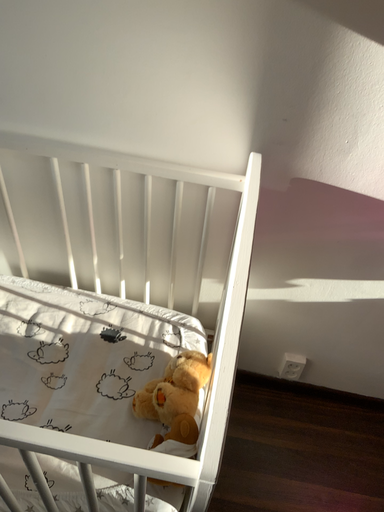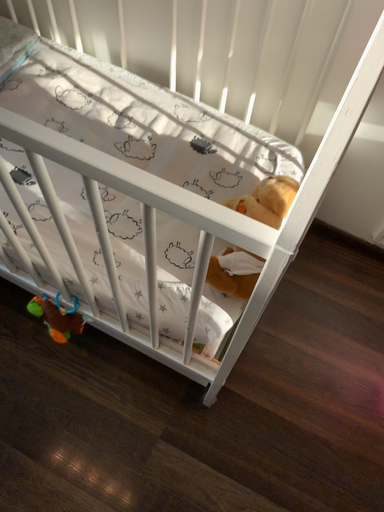
Question: How did the camera likely rotate when shooting the video?

Choices:
 (A) rotated downward
 (B) rotated upward

Answer: (A)